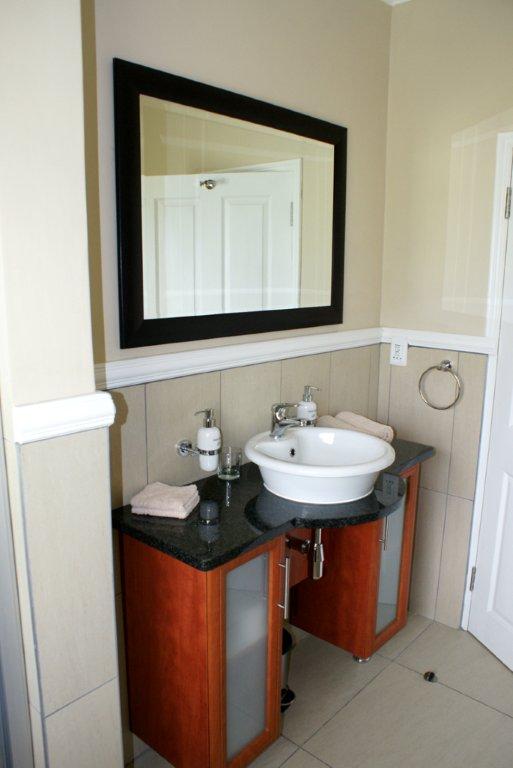
Image resolution: width=513 pixels, height=768 pixels. I want to click on floor, so click(x=418, y=717).